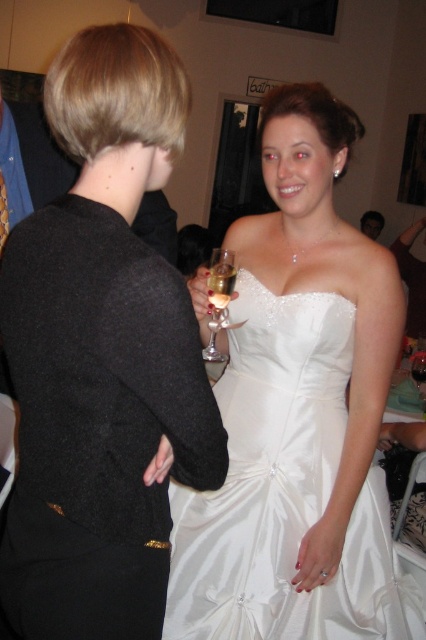
Question: Can you confirm if clear glass wine glass at center is thinner than translucent glass at upper center?

Choices:
 (A) yes
 (B) no

Answer: (B)

Question: Which point is closer to the camera?

Choices:
 (A) (417, 381)
 (B) (396, 240)
 (C) (215, 268)

Answer: (C)

Question: Among these points, which one is farthest from the camera?

Choices:
 (A) (114, 116)
 (B) (374, 232)

Answer: (B)

Question: Does black wool sweater at left come in front of translucent glass at upper center?

Choices:
 (A) yes
 (B) no

Answer: (A)

Question: Among these objects, which one is farthest from the camera?

Choices:
 (A) transparent glass at center
 (B) translucent glass at upper center

Answer: (A)

Question: Is satin white dress at center thinner than matte black dress at center?

Choices:
 (A) no
 (B) yes

Answer: (A)